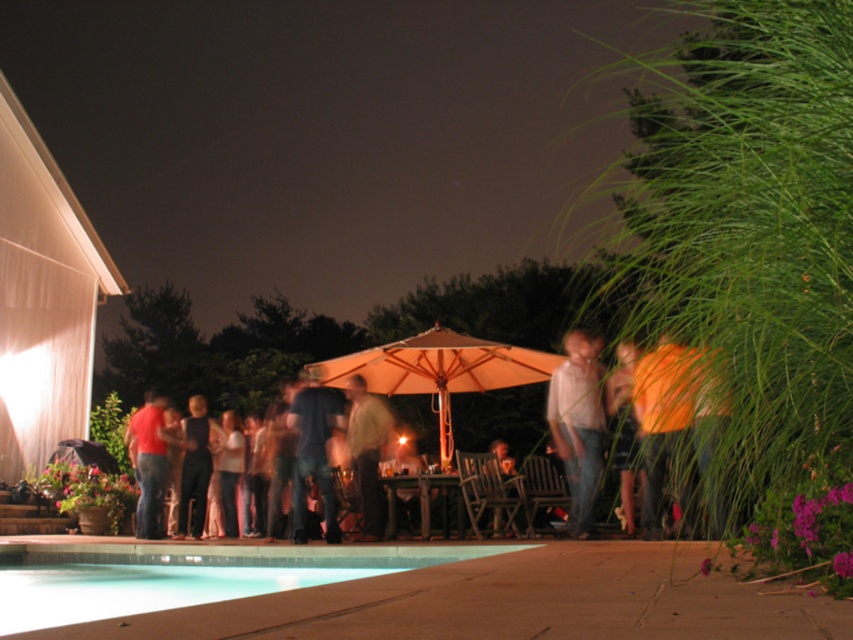
Question: Considering the relative positions of light brown denim jeans at center and matte red shirt at left in the image provided, where is light brown denim jeans at center located with respect to matte red shirt at left?

Choices:
 (A) above
 (B) below

Answer: (A)

Question: Does light brown fabric shirt at center appear on the left side of matte red shirt at left?

Choices:
 (A) yes
 (B) no

Answer: (B)

Question: Is matte orange umbrella at center thinner than light brown denim jeans at center?

Choices:
 (A) yes
 (B) no

Answer: (B)

Question: Considering the real-world distances, which object is farthest from the clear glass pool at lower center?

Choices:
 (A) matte orange umbrella at center
 (B) matte blue jeans at center

Answer: (A)

Question: Among these objects, which one is farthest from the camera?

Choices:
 (A) matte blue jeans at center
 (B) matte red shirt at left
 (C) light brown denim jeans at center
 (D) denim jeans at center

Answer: (B)

Question: Which point is farther from the camera taking this photo?

Choices:
 (A) (347, 381)
 (B) (434, 332)

Answer: (B)